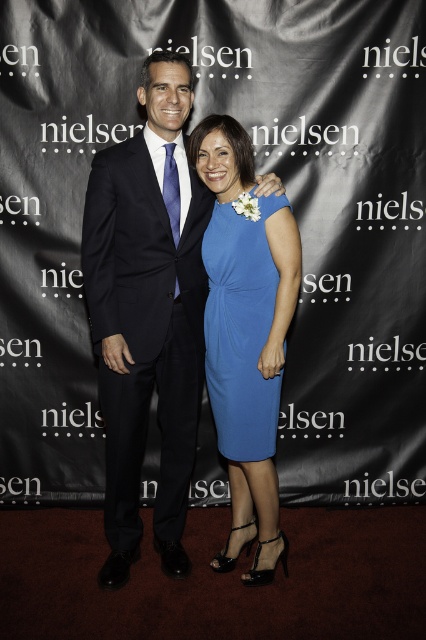
Between matte black suit at center and blue satin dress at center, which one has less height?

matte black suit at center is shorter.

Can you confirm if matte black suit at center is thinner than blue satin dress at center?

No.

Find the location of a particular element. matte black suit at center is located at coordinates (144, 332).

Can you confirm if blue satin dress at center is positioned to the right of matte blue dress at center?

Correct, you'll find blue satin dress at center to the right of matte blue dress at center.

Does blue satin dress at center have a greater height compared to matte blue dress at center?

Yes, blue satin dress at center is taller than matte blue dress at center.

Between point (270, 243) and point (215, 337), which one is positioned in front?

Positioned in front is point (270, 243).

You are a GUI agent. You are given a task and a screenshot of the screen. Output one action in this format:
    pyautogui.click(x=<x>, y=<y>)
    Task: Click on the blue satin dress at center
    
    Given the screenshot: What is the action you would take?
    pyautogui.click(x=245, y=333)

Does matte black suit at center lie behind matte blue dress at center?

That is False.

Between matte black suit at center and matte blue dress at center, which one has more height?

Standing taller between the two is matte black suit at center.

Between point (120, 163) and point (236, 323), which one is positioned behind?

The point (236, 323) is behind.

Locate an element on the screen. The width and height of the screenshot is (426, 640). matte black suit at center is located at coordinates (144, 332).